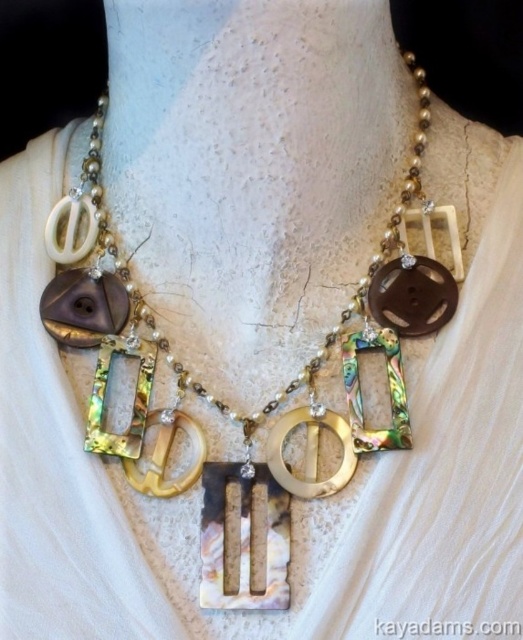
Question: Can you confirm if shiny abalone shell necklace at center is positioned above black pearl letter k at center?

Choices:
 (A) no
 (B) yes

Answer: (B)

Question: Is shiny abalone shell necklace at center closer to the viewer compared to black pearl letter k at center?

Choices:
 (A) yes
 (B) no

Answer: (B)

Question: Is shiny abalone shell necklace at center bigger than black pearl letter k at center?

Choices:
 (A) no
 (B) yes

Answer: (B)

Question: Which point appears closest to the camera in this image?

Choices:
 (A) (383, 627)
 (B) (126, 320)

Answer: (A)

Question: Which object is closer to the camera taking this photo?

Choices:
 (A) shiny abalone shell necklace at center
 (B) black pearl letter k at center

Answer: (B)